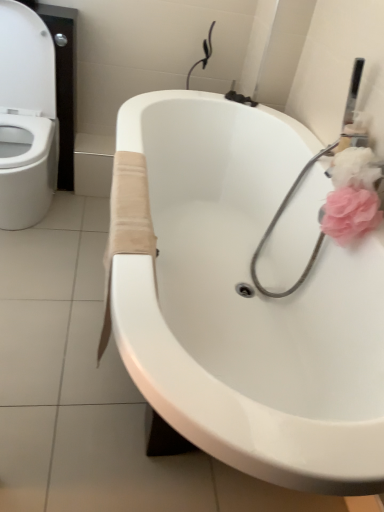
Question: From a real-world perspective, does pink fluffy flower at upper right, acting as the second flower starting from the bottom, stand above white glossy toilet at left?

Choices:
 (A) yes
 (B) no

Answer: (A)

Question: Is the surface of pink fluffy flower at upper right, which is the 1th flower in top-to-bottom order, in direct contact with white glossy toilet at left?

Choices:
 (A) no
 (B) yes

Answer: (A)

Question: Can you confirm if pink fluffy flower at upper right, acting as the second flower starting from the bottom, is smaller than white glossy toilet at left?

Choices:
 (A) yes
 (B) no

Answer: (A)

Question: Is pink fluffy flower at upper right, acting as the second flower starting from the bottom, closer to the viewer compared to white glossy toilet at left?

Choices:
 (A) yes
 (B) no

Answer: (A)

Question: Is pink fluffy flower at upper right, which is the 1th flower in top-to-bottom order, further to camera compared to white glossy toilet at left?

Choices:
 (A) no
 (B) yes

Answer: (A)

Question: Is pink fluffy flower at upper right, which is the 1th flower in top-to-bottom order, wider than white glossy toilet at left?

Choices:
 (A) no
 (B) yes

Answer: (A)

Question: Could you tell me if white glossy toilet at left is turned towards pink fluffy sponge at upper right, acting as the first flower starting from the bottom?

Choices:
 (A) no
 (B) yes

Answer: (A)

Question: Can you confirm if white glossy toilet at left is bigger than pink fluffy sponge at upper right, acting as the first flower starting from the bottom?

Choices:
 (A) no
 (B) yes

Answer: (B)

Question: From the image's perspective, is white glossy toilet at left beneath pink fluffy sponge at upper right, the second flower in the top-to-bottom sequence?

Choices:
 (A) yes
 (B) no

Answer: (B)

Question: Is white glossy toilet at left at the left side of pink fluffy sponge at upper right, acting as the first flower starting from the bottom?

Choices:
 (A) yes
 (B) no

Answer: (A)

Question: Is white glossy toilet at left shorter than pink fluffy sponge at upper right, the second flower in the top-to-bottom sequence?

Choices:
 (A) no
 (B) yes

Answer: (A)

Question: Is white glossy toilet at left positioned before pink fluffy sponge at upper right, the second flower in the top-to-bottom sequence?

Choices:
 (A) yes
 (B) no

Answer: (B)

Question: Considering the relative sizes of white glossy bathtub at center and white glossy toilet at left in the image provided, is white glossy bathtub at center thinner than white glossy toilet at left?

Choices:
 (A) no
 (B) yes

Answer: (A)